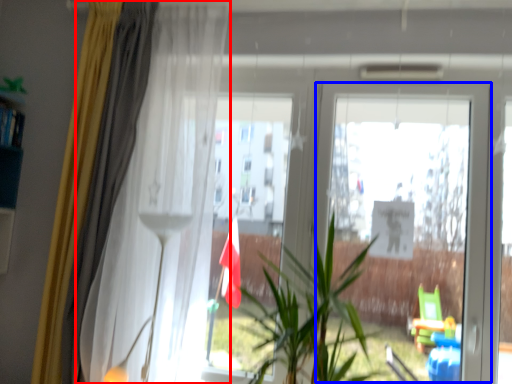
Question: Which object appears farthest to the camera in this image, curtain (highlighted by a red box) or screen door (highlighted by a blue box)?

Choices:
 (A) curtain
 (B) screen door

Answer: (B)